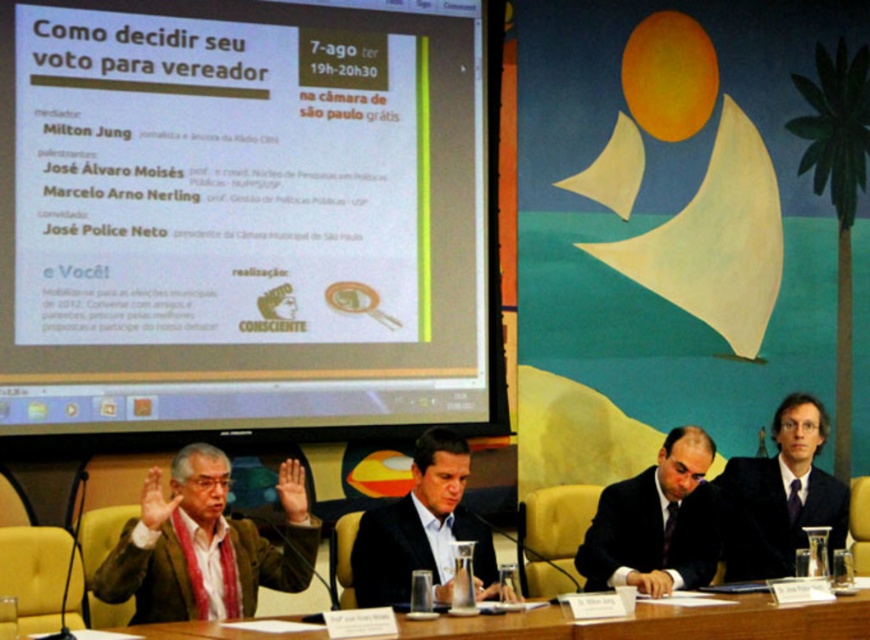
Question: Which object is the farthest from the wooden table at center?

Choices:
 (A) dark blue suit at center
 (B) dark brown leather jacket at center
 (C) black matte suit at center

Answer: (A)

Question: Is white matte projector screen at upper left to the right of black matte suit at center from the viewer's perspective?

Choices:
 (A) yes
 (B) no

Answer: (B)

Question: Which point is farther to the camera?

Choices:
 (A) wooden table at center
 (B) dark brown leather jacket at center
 (C) dark blue suit at center
 (D) black matte suit at center

Answer: (C)

Question: Is white matte projector screen at upper left bigger than dark brown leather jacket at center?

Choices:
 (A) yes
 (B) no

Answer: (A)

Question: Can you confirm if wooden table at center is smaller than dark blue suit at center?

Choices:
 (A) yes
 (B) no

Answer: (B)

Question: Which point is closer to the camera?

Choices:
 (A) (352, 572)
 (B) (432, 248)

Answer: (A)